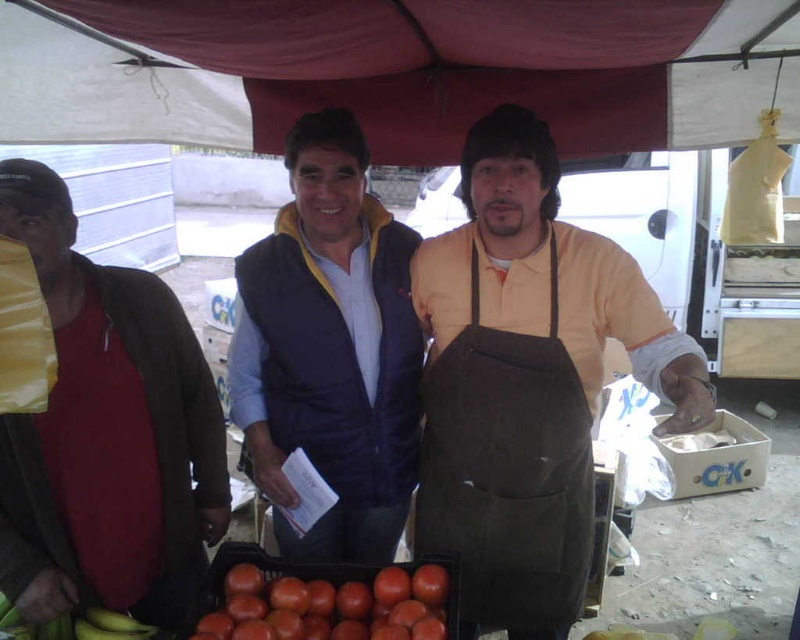
Question: Which is nearer to the shiny red tomato at center?

Choices:
 (A) shiny red tomatoes at center
 (B) red matte shirt at left
 (C) brown canvas apron at center

Answer: (A)

Question: Is brown canvas apron at center positioned at the back of red matte shirt at left?

Choices:
 (A) yes
 (B) no

Answer: (B)

Question: Does velvet-like blue vest at center have a larger size compared to shiny red tomato at center?

Choices:
 (A) no
 (B) yes

Answer: (B)

Question: Which of the following is the farthest from the observer?

Choices:
 (A) (258, 400)
 (B) (438, 580)
 (C) (445, 522)

Answer: (A)

Question: Which object is farther from the camera taking this photo?

Choices:
 (A) shiny red tomatoes at center
 (B) red matte shirt at left
 (C) shiny red tomato at center
 (D) velvet-like blue vest at center

Answer: (D)

Question: Is brown canvas apron at center in front of red matte shirt at left?

Choices:
 (A) yes
 (B) no

Answer: (A)